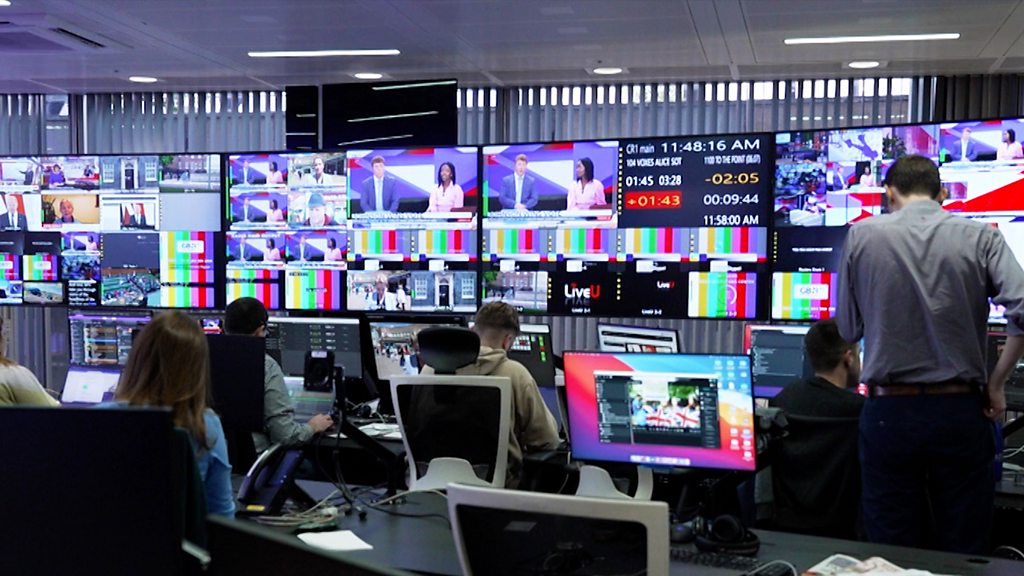
Find the location of a particular element. large tv screen is located at coordinates (87, 217), (349, 222), (622, 223), (866, 206).